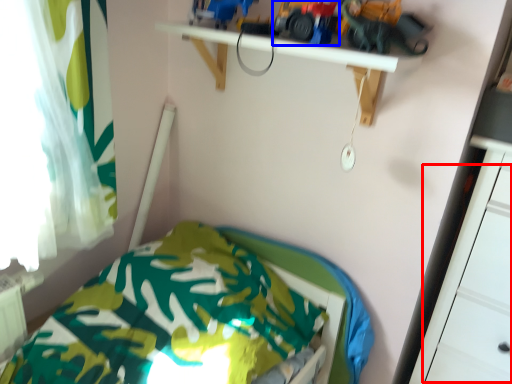
Question: Which point is further to the camera, drawer (highlighted by a red box) or toy car (highlighted by a blue box)?

Choices:
 (A) drawer
 (B) toy car

Answer: (B)